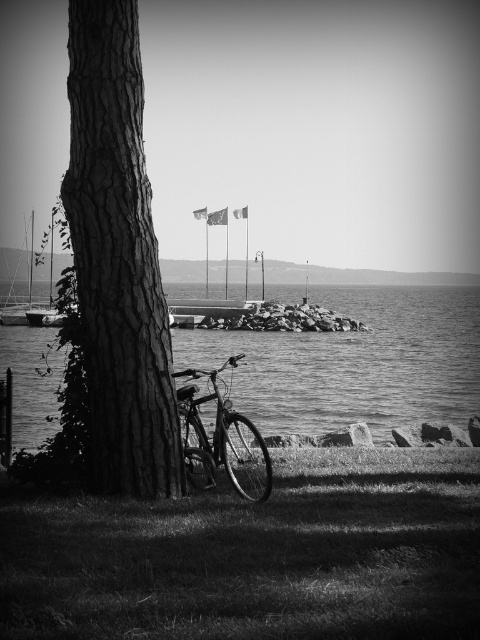
You are standing at the edge of the scene and want to walk to the smooth water at center. Which direction should you move relative to the grassy lawn at lower left?

Since the grassy lawn at lower left is closer to the viewer than the smooth water at center, you should move away from the grassy lawn at lower left towards the center of the scene to reach the smooth water at center.

You are standing at the lakeside and see the metallic bicycle at lower left and the metallic sailboat at left. Which object is closer to the water?

The metallic bicycle at lower left is closer to the water because it is located below the metallic sailboat at left, meaning it is positioned lower in the scene and nearer to the water level.

You are standing at the center of the image and want to walk to the grassy lawn at lower left. Which direction should you move in to reach it?

The grassy lawn at lower left is located at point (256, 556), so you should move towards the lower left direction to reach it.